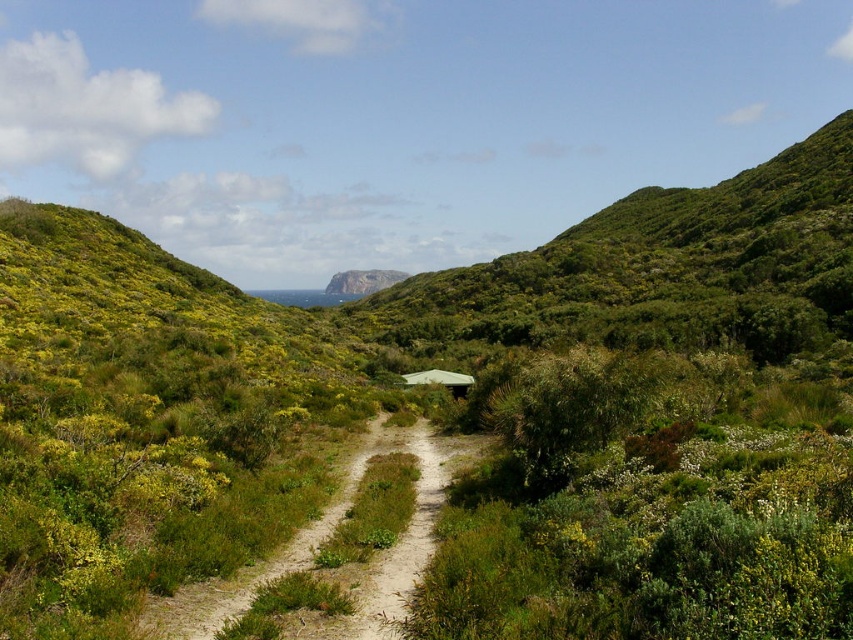
Question: Which point is farther to the camera?

Choices:
 (A) (453, 396)
 (B) (338, 291)

Answer: (B)

Question: Is brown sandy dirt track at center to the left of green matte hut at center from the viewer's perspective?

Choices:
 (A) yes
 (B) no

Answer: (A)

Question: Among these objects, which one is nearest to the camera?

Choices:
 (A) green matte hut at center
 (B) rugged stone mountain at center

Answer: (A)

Question: Considering the relative positions of brown sandy dirt track at center and green matte hut at center in the image provided, where is brown sandy dirt track at center located with respect to green matte hut at center?

Choices:
 (A) above
 (B) below

Answer: (B)

Question: Which object is closer to the camera taking this photo?

Choices:
 (A) rugged stone mountain at center
 (B) green matte hut at center
 (C) brown sandy dirt track at center

Answer: (C)

Question: Is brown sandy dirt track at center thinner than green matte hut at center?

Choices:
 (A) no
 (B) yes

Answer: (B)